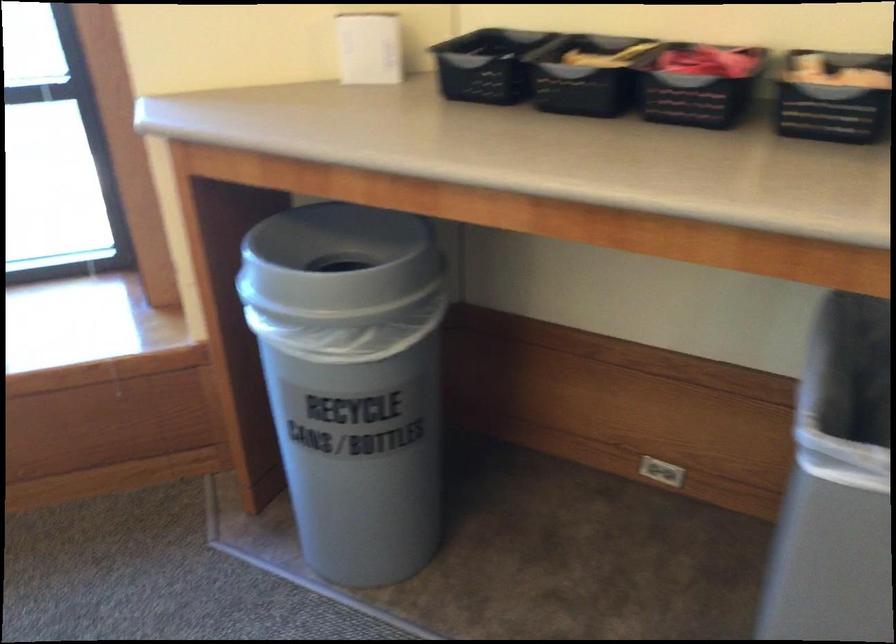
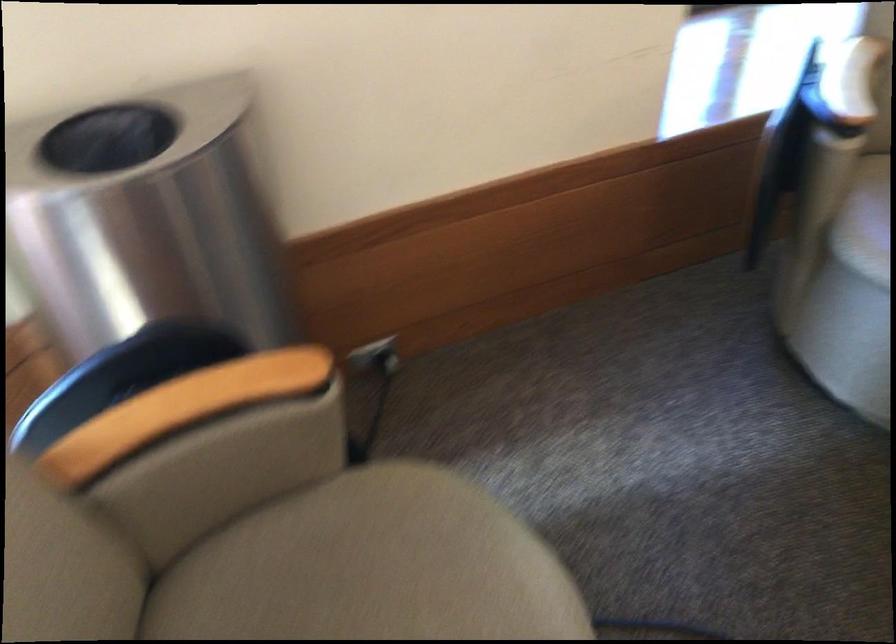
Question: The images are taken continuously from a first-person perspective. In which direction are you moving?

Choices:
 (A) Left
 (B) Right
 (C) Forward
 (D) Backward

Answer: (A)